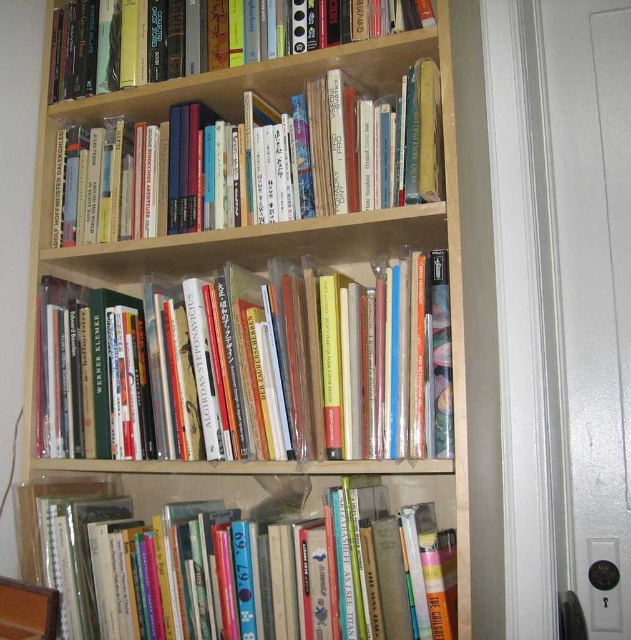
You are standing in front of the wooden bookshelf and notice two points marked on the wall. The first point is at coordinates point (134,147) and the second point is at point (151,6). Which point is closer to you?

Point (134,147) is in front of point (151,6), so the first point is closer to you.

You are organizing a library and need to place a large book on the shelf. You have two options for placement between the hardcover books at lower center and the hardcover books at upper left. Which location would be more suitable for the large book?

The hardcover books at lower center are bigger than the hardcover books at upper left, so placing the large book among the hardcover books at lower center would be more suitable.